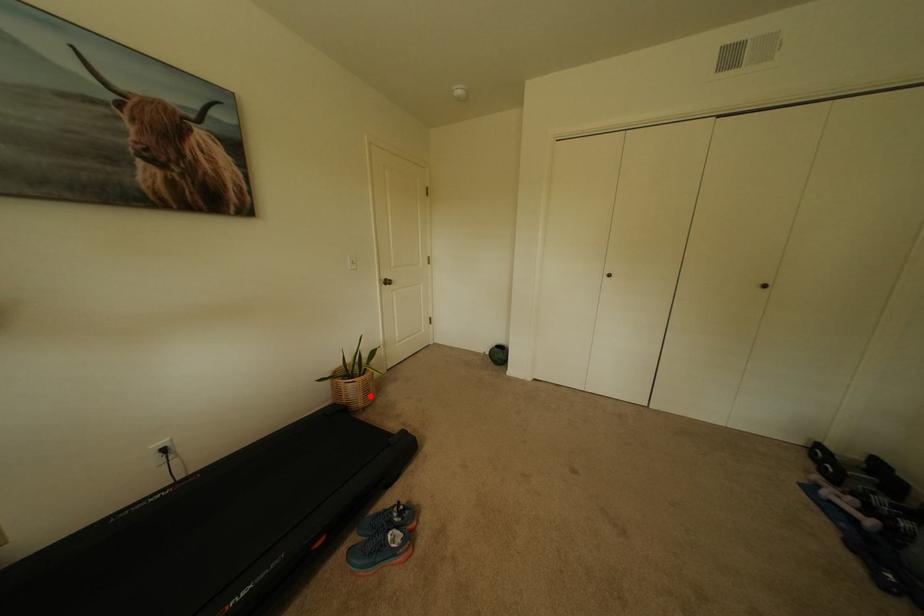
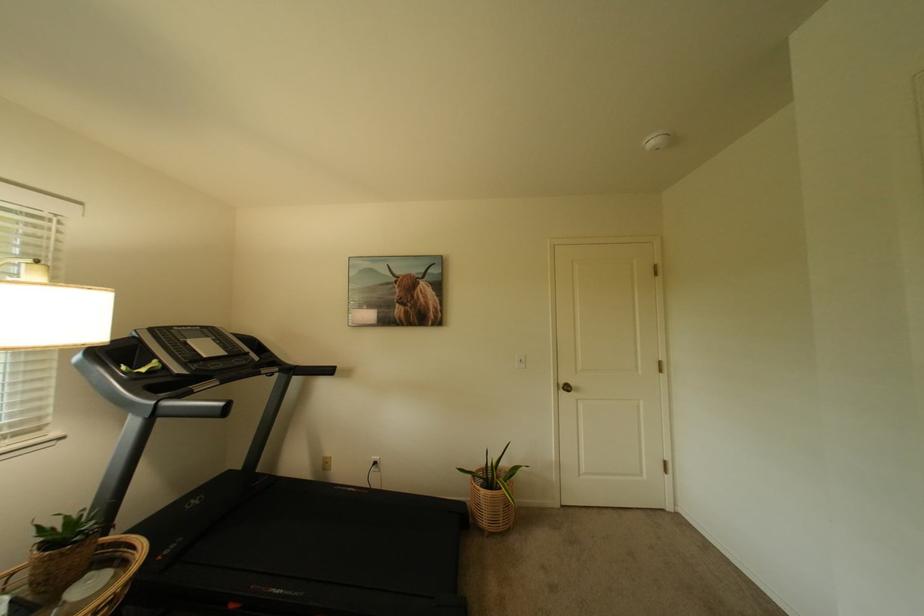
Question: I am providing you with two images of the same scene from different viewpoints. A red point is shown in image1. For the corresponding object point in image2, is it positioned nearer or farther from the camera?

Choices:
 (A) Nearer
 (B) Farther

Answer: (B)